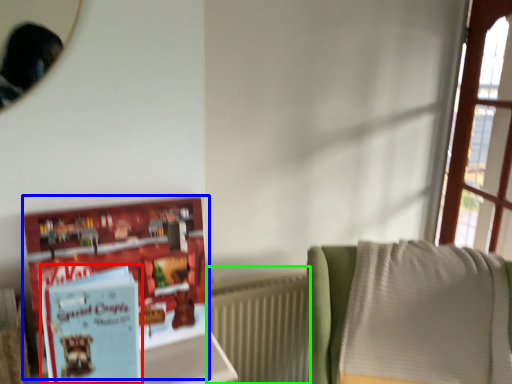
Question: Considering the real-world distances, which object is closest to paperback book (highlighted by a red box)? book (highlighted by a blue box) or radiator (highlighted by a green box).

Choices:
 (A) book
 (B) radiator

Answer: (A)